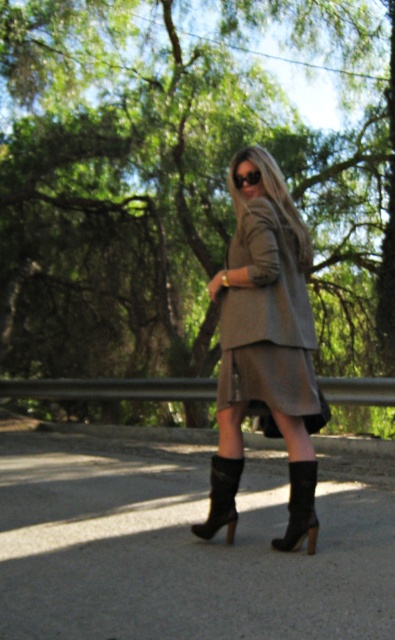
You are a fashion designer who wants to create a matching accessory for the black suede boot at lower center and the matte black sunglasses at center. Which object should you consider in terms of width to ensure the accessory complements both items appropriately?

The black suede boot at lower center might be wider than the matte black sunglasses at center, so the accessory should be designed to complement the width of the boot to maintain balance with both items.